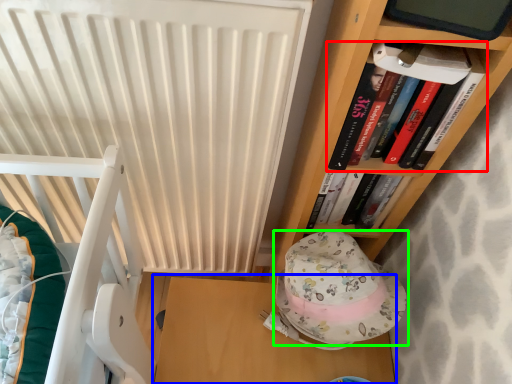
Question: Estimate the real-world distances between objects in this image. Which object is closer to book (highlighted by a red box), table (highlighted by a blue box) or hat (highlighted by a green box)?

Choices:
 (A) table
 (B) hat

Answer: (B)